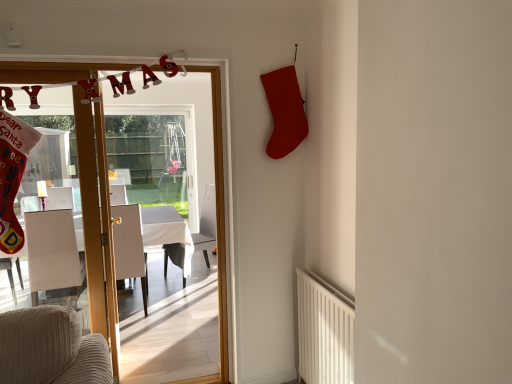
Question: Would you say white fabric armchair at center, positioned as the third armchair in left-to-right order, is to the left or to the right of white textured radiator at lower right in the picture?

Choices:
 (A) right
 (B) left

Answer: (B)

Question: Is white fabric armchair at center, the first armchair positioned from the right, in front of or behind white textured radiator at lower right in the image?

Choices:
 (A) behind
 (B) front

Answer: (A)

Question: Considering the real-world distances, which object is farthest from the white fabric armchair at center, positioned as the third armchair in left-to-right order?

Choices:
 (A) white fabric armchair at left, marked as the 3th armchair in a right-to-left arrangement
 (B) white textured radiator at lower right
 (C) white glossy door at center
 (D) white fabric armchair at center, placed as the 2th armchair when sorted from left to right
 (E) white glossy table at left

Answer: (B)

Question: Which of these objects is positioned closest to the white fabric armchair at center, which appears as the 2th armchair when viewed from the right?

Choices:
 (A) white textured radiator at lower right
 (B) white fabric armchair at center, the first armchair positioned from the right
 (C) white glossy door at center
 (D) white glossy table at left
 (E) white fabric armchair at left, marked as the 3th armchair in a right-to-left arrangement

Answer: (D)